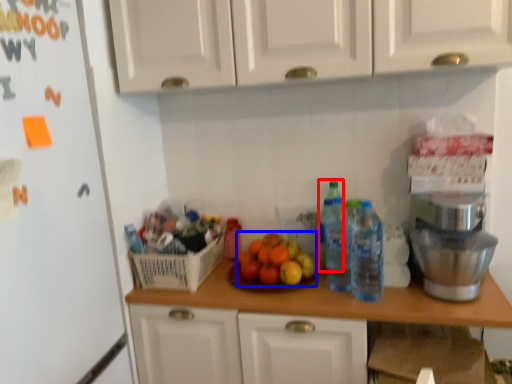
Question: Which object is closer to the camera taking this photo, bottle (highlighted by a red box) or fruit (highlighted by a blue box)?

Choices:
 (A) bottle
 (B) fruit

Answer: (B)